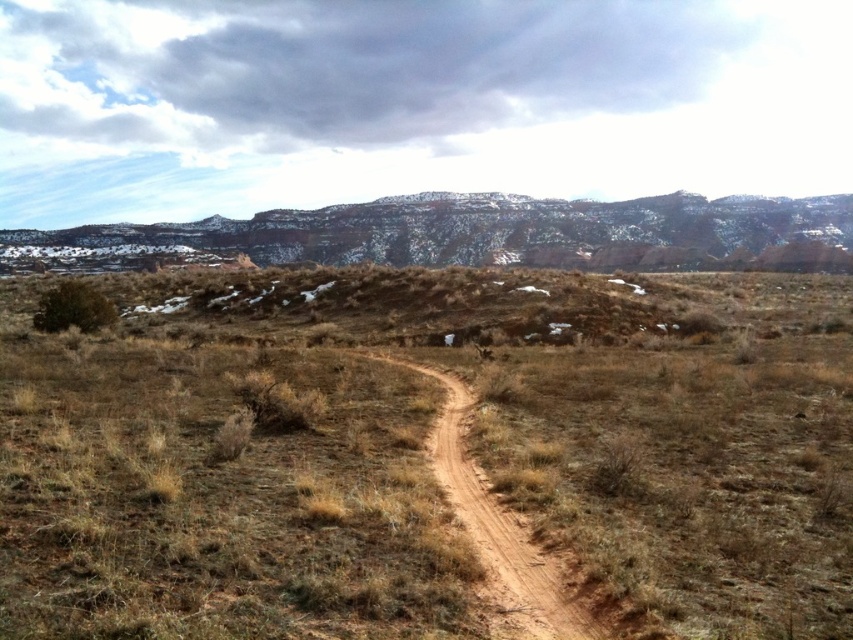
Question: Does brown dirt path at center lie in front of brown dirt track at center?

Choices:
 (A) no
 (B) yes

Answer: (B)

Question: Which point appears farthest from the camera in this image?

Choices:
 (A) (521, 541)
 (B) (438, 225)

Answer: (B)

Question: Is rustic stone mountain at upper center thinner than brown dirt track at center?

Choices:
 (A) yes
 (B) no

Answer: (B)

Question: Which of these objects is positioned closest to the brown dirt track at center?

Choices:
 (A) brown dirt path at center
 (B) rustic stone mountain at upper center

Answer: (A)

Question: Is brown dirt path at center wider than brown dirt track at center?

Choices:
 (A) no
 (B) yes

Answer: (B)

Question: Which object is positioned farthest from the rustic stone mountain at upper center?

Choices:
 (A) brown dirt track at center
 (B) brown dirt path at center

Answer: (A)